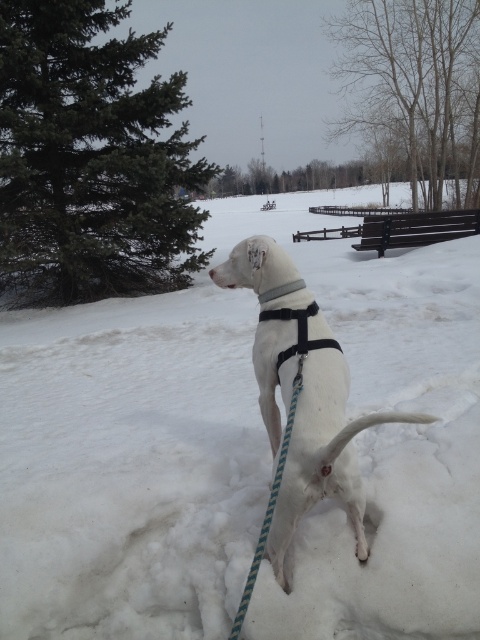
You are a dog owner who wants to ensure your dog stays warm. You see the white fluffy snow at center and the white matte harness at center. Which item is closer to the dog?

The white fluffy snow at center is located above the white matte harness at center, so the white matte harness at center is closer to the dog since it is underneath the snow.

You are a dog owner trying to decide whether to let your dog play in the snow. Based on the scene, which object is wider, the white fluffy snow at center or the black nylon neckband at center?

The white fluffy snow at center is wider than the black nylon neckband at center.